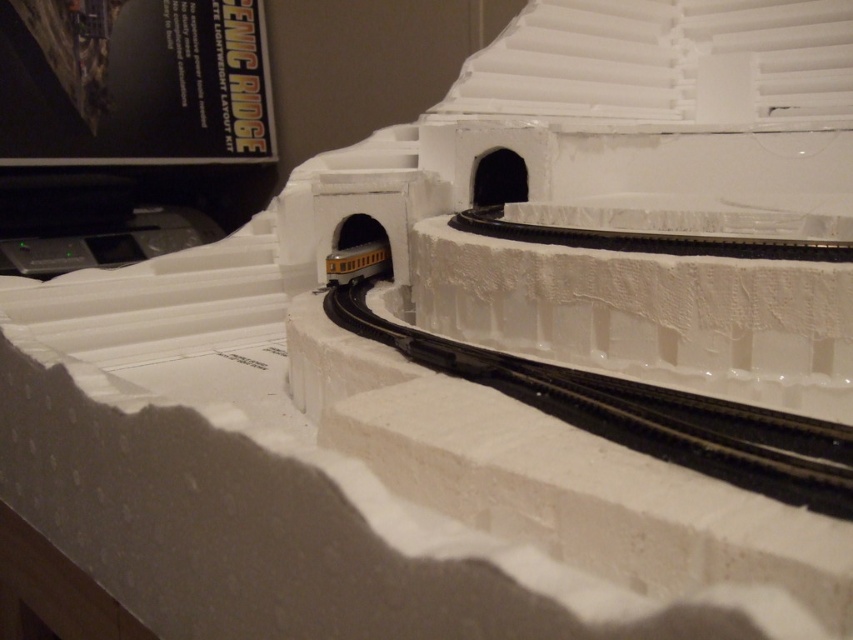
You are a model train enthusiast inspecting the layout. The black rubber train track at center is crucial for the train to navigate the loop. Can you confirm if the track is positioned correctly based on its coordinates?

The black rubber train track at center is located at point (640,413), which is the correct position for the train to navigate the loop.

You are a model train operator observing the setup. There are two points marked in the scene, point (842,472) and point (363,253). Which point is nearer to you?

Point (842,472) is closer to the viewer than point (363,253).

You are a model train enthusiast who wants to place a new train car between the black rubber train track at center and the yellow matte train at center. According to the scene, which object should the new car be placed closer to?

The new car should be placed closer to the yellow matte train at center because the black rubber train track at center is to the right of the yellow matte train at center.